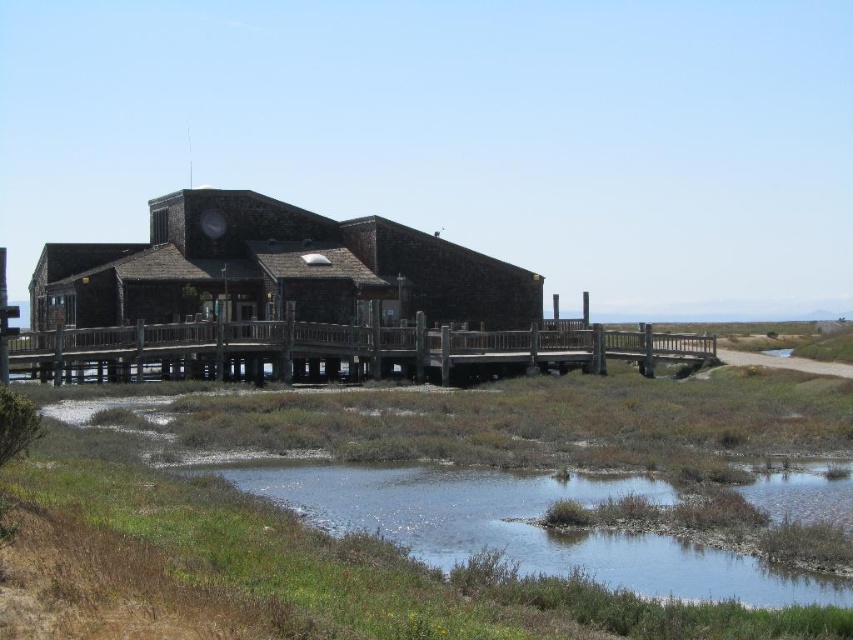
You are planning to build a small shed in your backyard and want to ensure it has enough space for storage. You see the brown wood hut at center and the clear water at lower center in the image. Which object in the image is larger in size?

The brown wood hut at center is bigger than clear water at lower center, so the brown wood hut at center is larger in size.

You are standing on the deck of the rustic building and notice a specific point marked at coordinates (274, 272). What does this point indicate?

The point at coordinates (274, 272) indicates the location of the brown wood hut at center.

You are standing on the deck of the rustic building and want to determine which of the two points, point (277, 220) or point (743, 563), is closer to you. Based on their positions, which point is nearer?

Point (277, 220) is further to the viewer than point (743, 563). Wait, that seems contradictory. Let me check the description again. The Objects Description states that point (277, 220) is further to the viewer than point (743, 563). Hmm, so if point A is further away than point B, then point B is closer to the viewer. Therefore, the answer should be point (743, 563) is closer.